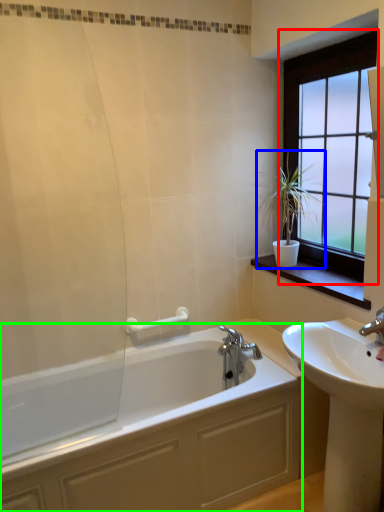
Question: Which object is the farthest from window (highlighted by a red box)? Choose among these: houseplant (highlighted by a blue box) or bathtub (highlighted by a green box).

Choices:
 (A) houseplant
 (B) bathtub

Answer: (B)